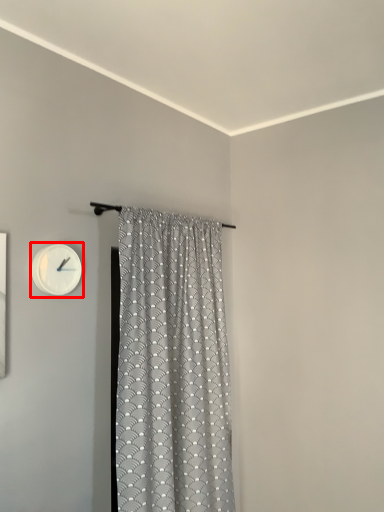
Question: Considering the relative positions of wall clock (annotated by the red box) and curtain in the image provided, where is wall clock (annotated by the red box) located with respect to the staircase?

Choices:
 (A) right
 (B) left

Answer: (B)